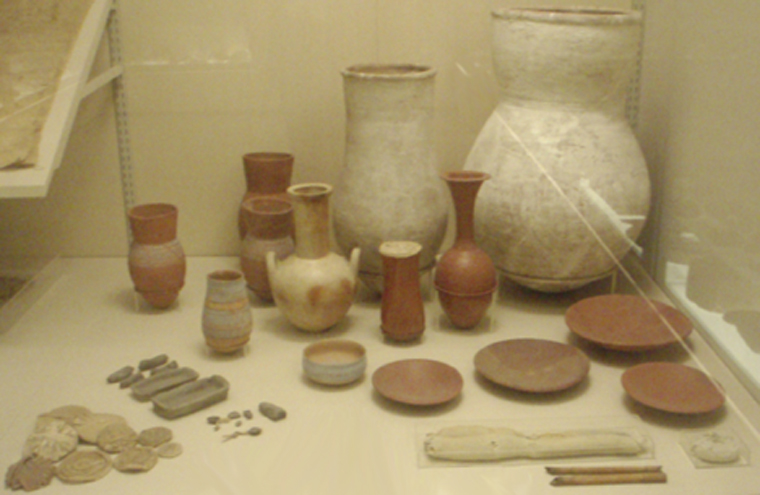
I want to click on walls, so [x=239, y=89], [x=698, y=131].